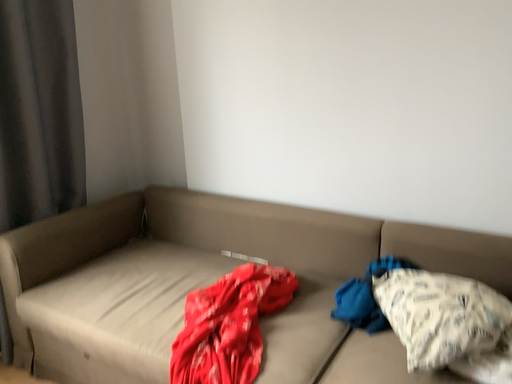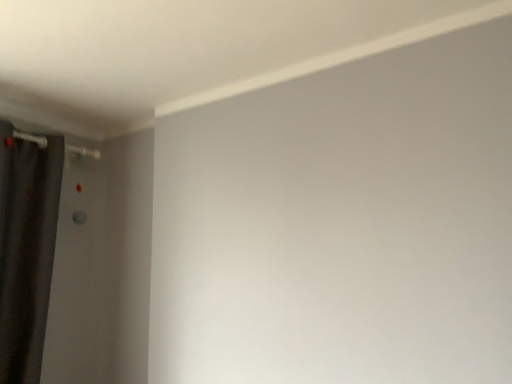
Question: How did the camera likely rotate when shooting the video?

Choices:
 (A) rotated downward
 (B) rotated upward

Answer: (B)